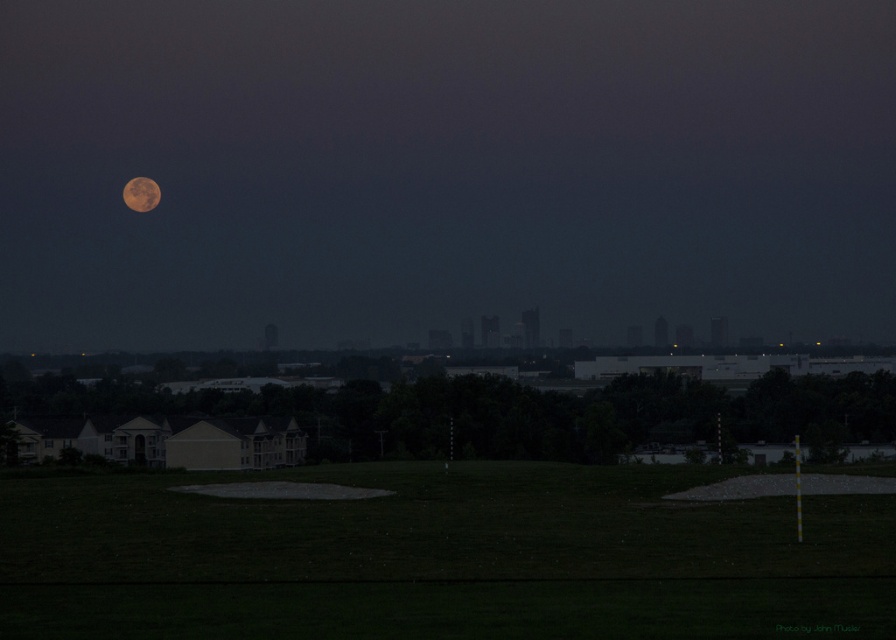
You are standing at the point marked by the coordinates point (438, 557) in the image. What is the name of the area you are currently standing on?

The point (438, 557) indicates the green grassy field at lower center, so you are standing on the green grassy field at lower center.

You are standing in the foreground of the scene and want to reach both points marked in the image. Which point, point (x=148, y=493) or point (x=142, y=193), will you reach first as you move forward?

Point (x=148, y=493) is closer to the camera than point (x=142, y=193), so you will reach point (x=148, y=493) first as you move forward.

You are standing at the center of the image. A drone is flying towards the green grassy field at lower center. What are the coordinates where the drone should land?

The green grassy field at lower center is located at coordinates point (438,557), so the drone should land there.